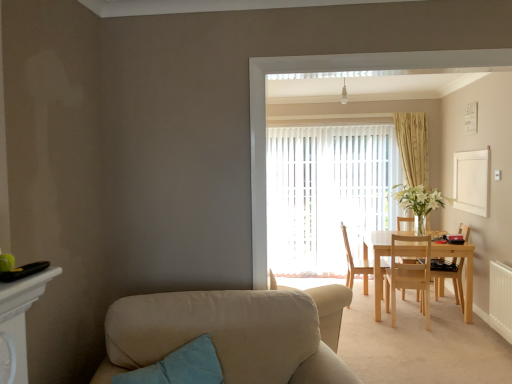
Where is `vacant region in front of light wood table at center`? Image resolution: width=512 pixels, height=384 pixels. vacant region in front of light wood table at center is located at coordinates click(x=437, y=340).